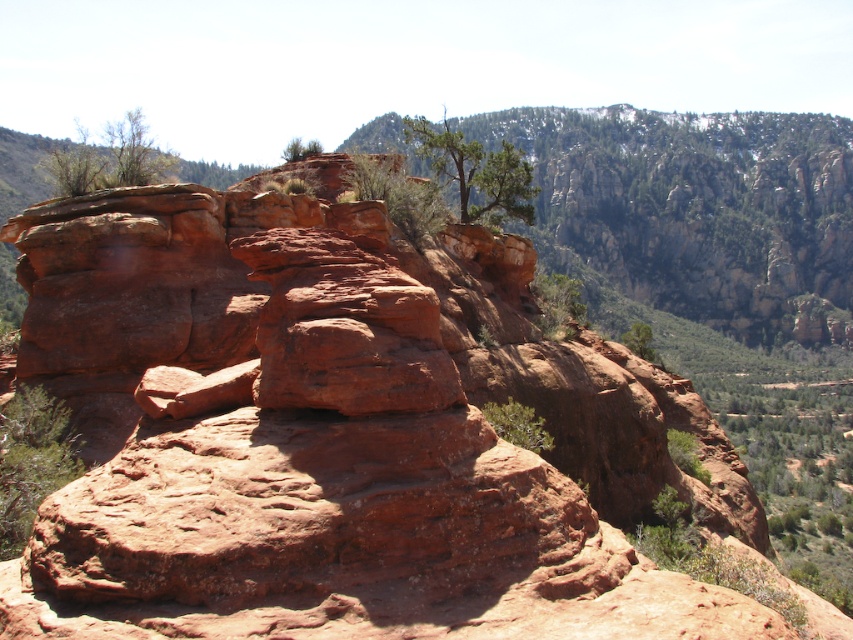
You are a hiker standing at the base of the large rock formation. You notice two green leafy trees in the scene. Which tree is closer to you, the green leafy tree at lower left or the green leafy tree at upper left?

The green leafy tree at lower left is closer to you because it is positioned in front of the green leafy tree at upper left.